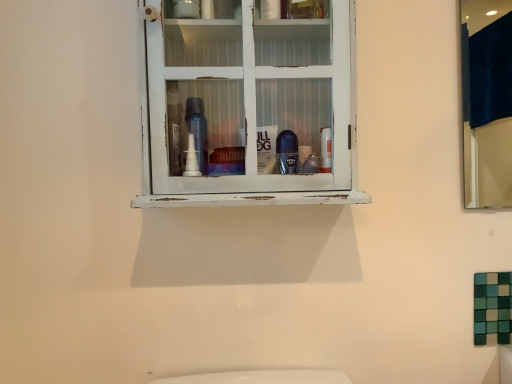
The height and width of the screenshot is (384, 512). Describe the element at coordinates (249, 108) in the screenshot. I see `white distressed cabinet at center` at that location.

You are a GUI agent. You are given a task and a screenshot of the screen. Output one action in this format:
    pyautogui.click(x=<x>, y=<y>)
    Task: Click on the white distressed cabinet at center
    
    Given the screenshot: What is the action you would take?
    pyautogui.click(x=249, y=108)

Where is `white distressed cabinet at center`? The width and height of the screenshot is (512, 384). white distressed cabinet at center is located at coordinates (249, 108).